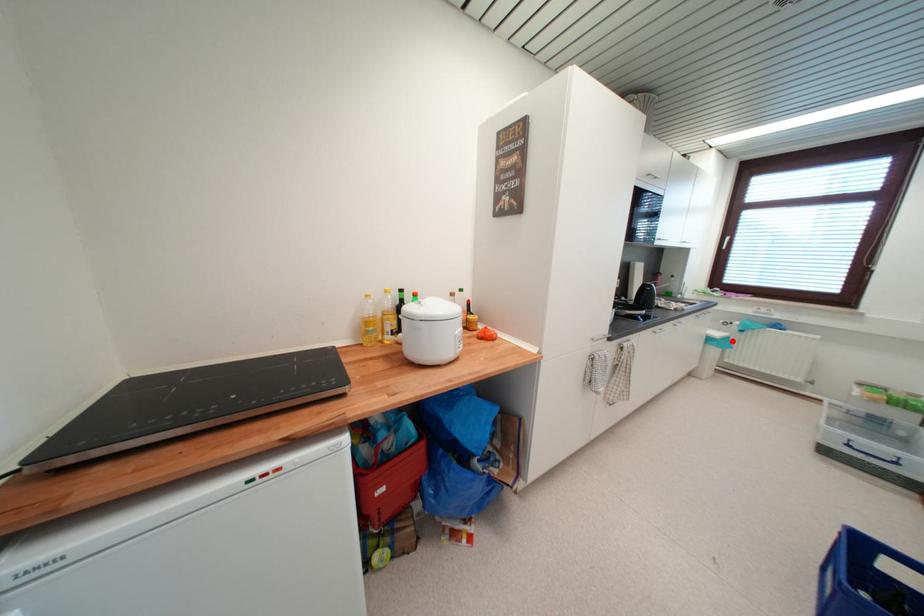
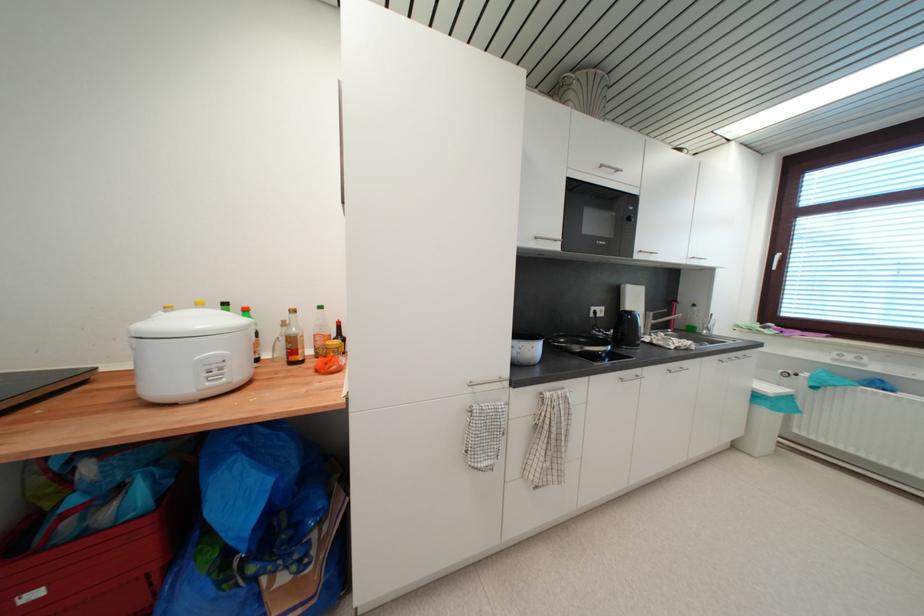
Where in the second image is the point corresponding to the highlighted location from the first image?

(795, 400)